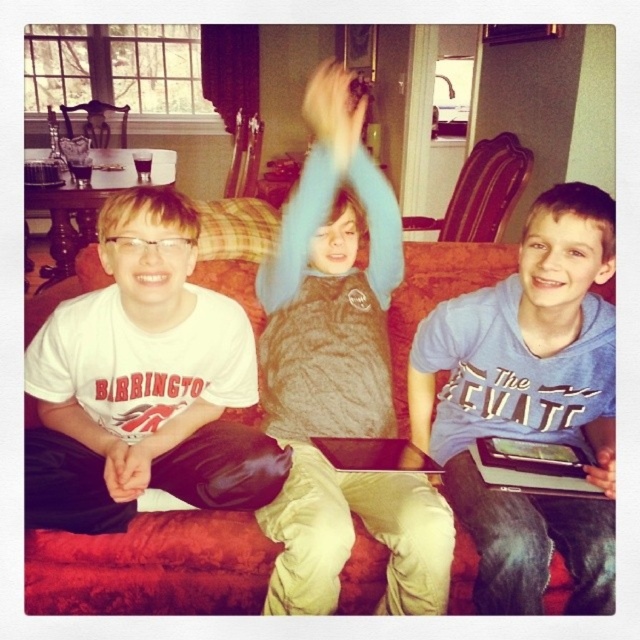
Does point (186, 346) lie in front of point (236, 260)?

Yes.

Between point (132, 420) and point (65, 609), which one is positioned in front?

Point (65, 609) is in front.

Locate an element on the screen. Image resolution: width=640 pixels, height=640 pixels. white cotton shirt at left is located at coordinates (144, 384).

Who is taller, white cotton shirt at left or blue cotton shirt at center?

blue cotton shirt at center is taller.

Which is behind, point (216, 380) or point (540, 506)?

Positioned behind is point (216, 380).

You are a GUI agent. You are given a task and a screenshot of the screen. Output one action in this format:
    pyautogui.click(x=<x>, y=<y>)
    Task: Click on the white cotton shirt at left
    
    Given the screenshot: What is the action you would take?
    pyautogui.click(x=144, y=384)

Based on the photo, how distant is fluffy brown vest at center from white cotton shirt at left?

fluffy brown vest at center is 11.97 inches from white cotton shirt at left.

Is fluffy brown vest at center thinner than white cotton shirt at left?

Yes.

I want to click on fluffy brown vest at center, so click(339, 376).

Where is `fluffy brown vest at center`? Image resolution: width=640 pixels, height=640 pixels. fluffy brown vest at center is located at coordinates (339, 376).